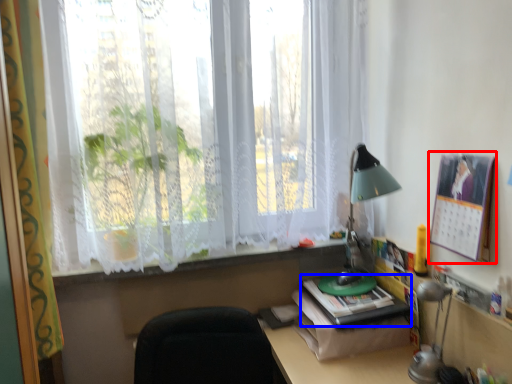
Question: Which object is further to the camera taking this photo, bulletin board (highlighted by a red box) or paperback book (highlighted by a blue box)?

Choices:
 (A) bulletin board
 (B) paperback book

Answer: (B)